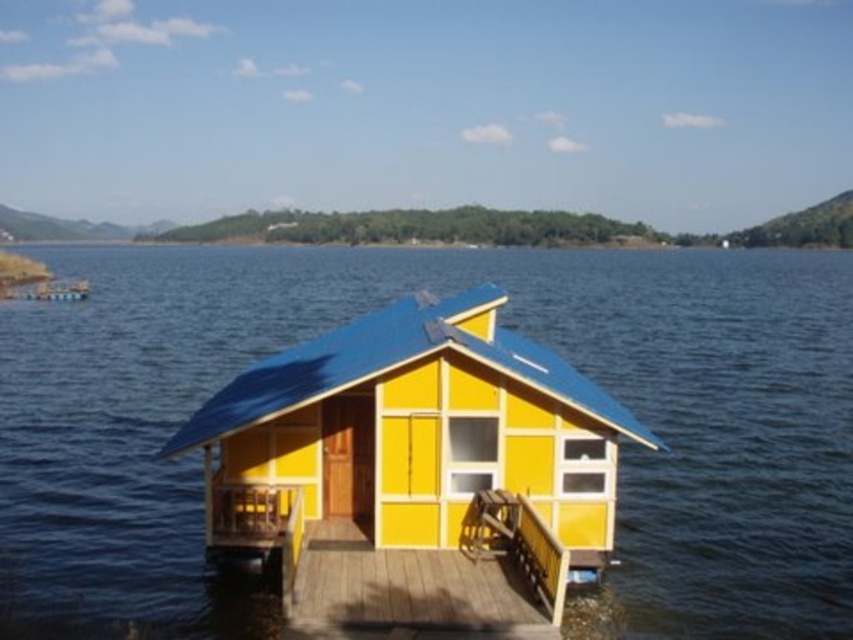
Looking at this image, who is lower down, wooden at center or yellow matte houseboat at center?

wooden at center is lower down.

Between point (544, 596) and point (56, 282), which one is positioned behind?

The point (56, 282) is more distant.

Locate an element on the screen. This screenshot has height=640, width=853. wooden at center is located at coordinates (433, 580).

Image resolution: width=853 pixels, height=640 pixels. I want to click on wooden at center, so click(433, 580).

Between yellow painted wood hut at center and yellow matte houseboat at center, which one is positioned lower?

Positioned lower is yellow painted wood hut at center.

Is yellow painted wood hut at center bigger than yellow matte houseboat at center?

Yes.

Is point (537, 436) positioned before point (70, 298)?

Yes, point (537, 436) is in front of point (70, 298).

Find the location of `yellow painted wood hut at center`. yellow painted wood hut at center is located at coordinates (410, 438).

Is blue water at center smaller than yellow matte houseboat at center?

No, blue water at center is not smaller than yellow matte houseboat at center.

What do you see at coordinates (508, 326) in the screenshot? I see `blue water at center` at bounding box center [508, 326].

You are a GUI agent. You are given a task and a screenshot of the screen. Output one action in this format:
    pyautogui.click(x=<x>, y=<y>)
    Task: Click on the blue water at center
    This screenshot has width=853, height=640.
    Given the screenshot: What is the action you would take?
    pyautogui.click(x=508, y=326)